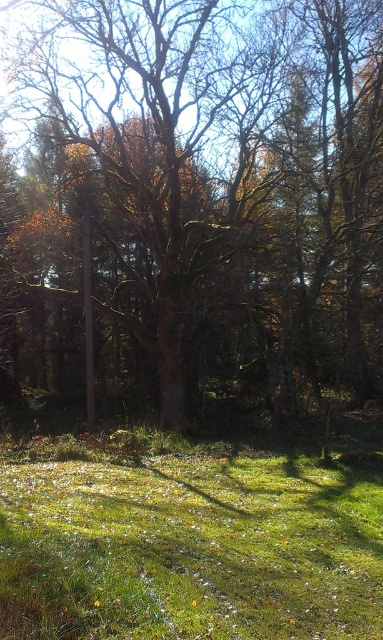
You are standing in the forest and want to place a picnic blanket on the green grassy at lower center. Is the brown rough tree at center directly above the spot where you want to place the blanket?

Yes, the brown rough tree at center is directly above the green grassy at lower center, so placing the picnic blanket there would mean it is under the tree.

You are a photographer standing in the forest scene. You want to take a closeup photo of the brown rough tree at center. The camera you are using has a minimum focusing distance of 10 meters. Will you be able to take the closeup photo without moving closer?

The brown rough tree at center is 14.52 meters away from camera, which is beyond the camera minimum focusing distance of 10 meters. Therefore, you can take the closeup photo without moving closer.

You are a hiker trying to navigate through the forest. You see the brown rough tree at center and the green grassy at lower center. Which object would you choose to walk around if you want to avoid the thickest part of the forest?

The brown rough tree at center is larger in size than the green grassy at lower center, so you should walk around the brown rough tree at center to avoid the thickest part of the forest.